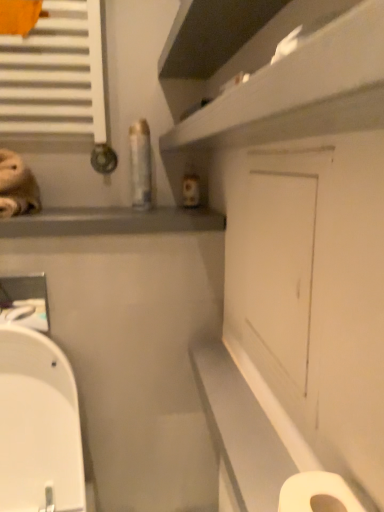
Measure the distance between white glossy toilet at lower left and camera.

The distance of white glossy toilet at lower left from camera is 98.18 centimeters.

This screenshot has height=512, width=384. Find the location of `white matte door at center`. white matte door at center is located at coordinates (274, 258).

Measure the distance between white matte toilet paper at lower right and camera.

white matte toilet paper at lower right and camera are 15.96 inches apart from each other.

Locate an element on the screen. The width and height of the screenshot is (384, 512). white glossy shelf at upper center is located at coordinates (300, 91).

Image resolution: width=384 pixels, height=512 pixels. Describe the element at coordinates (111, 222) in the screenshot. I see `matte gray window sill at upper left` at that location.

You are a GUI agent. You are given a task and a screenshot of the screen. Output one action in this format:
    pyautogui.click(x=<x>, y=<y>)
    Task: Click on the white glossy toilet at lower left
    
    Given the screenshot: What is the action you would take?
    pyautogui.click(x=38, y=425)

From the picture: Is white glossy shelf at upper center inside the boundaries of matte gray window sill at upper left, or outside?

white glossy shelf at upper center is located beyond the bounds of matte gray window sill at upper left.

From the image's perspective, which one is positioned lower, white glossy shelf at upper center or matte gray window sill at upper left?

matte gray window sill at upper left, from the image's perspective.

Is white glossy shelf at upper center oriented towards matte gray window sill at upper left?

No, white glossy shelf at upper center is not facing towards matte gray window sill at upper left.

From a real-world perspective, is white glossy shelf at upper center over matte gray window sill at upper left?

Yes, from a real-world perspective, white glossy shelf at upper center is on top of matte gray window sill at upper left.

From the picture: How different are the orientations of white matte toilet paper at lower right and white glossy shelf at upper center in degrees?

The facing directions of white matte toilet paper at lower right and white glossy shelf at upper center are 0.797 degrees apart.

From the image's perspective, would you say white matte toilet paper at lower right is positioned over white glossy shelf at upper center?

No, from the image's perspective, white matte toilet paper at lower right is not over white glossy shelf at upper center.

Can you confirm if white matte toilet paper at lower right is shorter than white glossy shelf at upper center?

Incorrect, the height of white matte toilet paper at lower right does not fall short of that of white glossy shelf at upper center.

Does white glossy shelf at upper center appear on the right side of white matte toilet paper at lower right?

Correct, you'll find white glossy shelf at upper center to the right of white matte toilet paper at lower right.

From the image's perspective, is white glossy shelf at upper center positioned above or below white matte toilet paper at lower right?

white glossy shelf at upper center is above white matte toilet paper at lower right.

Which of these two, white glossy shelf at upper center or white matte toilet paper at lower right, stands taller?

Standing taller between the two is white matte toilet paper at lower right.

Are white glossy toilet at lower left and white glossy shelf at upper center making contact?

white glossy toilet at lower left and white glossy shelf at upper center are not in contact.

Locate an element on the screen. toilet below the white glossy shelf at upper center (from the image's perspective) is located at coordinates (38, 425).

Is white glossy shelf at upper center completely or partially inside white glossy toilet at lower left?

No, white glossy shelf at upper center is located outside of white glossy toilet at lower left.

In the scene shown: From the image's perspective, who appears lower, white glossy toilet at lower left or white glossy shelf at upper center?

white glossy toilet at lower left is shown below in the image.

From the image's perspective, relative to matte gray window sill at upper left, is white glossy toilet at lower left above or below?

Based on their image positions, white glossy toilet at lower left is located beneath matte gray window sill at upper left.

Would you say white glossy toilet at lower left is outside matte gray window sill at upper left?

Yes.

Does point (13, 358) come behind point (163, 211)?

That is False.

Which object is positioned more to the right, white glossy toilet at lower left or matte gray window sill at upper left?

matte gray window sill at upper left is more to the right.

At what (x,y) coordinates should I click in order to perform the action: click on window sill on the left of white matte door at center. Please return your answer as a coordinate pair (x, y). The width and height of the screenshot is (384, 512). Looking at the image, I should click on (111, 222).

Consider the image. Is matte gray window sill at upper left facing towards white matte door at center?

Yes, matte gray window sill at upper left is oriented towards white matte door at center.

From the image's perspective, which one is positioned lower, matte gray window sill at upper left or white matte door at center?

white matte door at center.

Does white matte door at center touch matte gray window sill at upper left?

No, white matte door at center is not beside matte gray window sill at upper left.

From a real-world perspective, between white matte door at center and matte gray window sill at upper left, who is vertically higher?

In real-world perspective, matte gray window sill at upper left is above.

In the scene shown: Does white matte door at center contain matte gray window sill at upper left?

No.

In the scene shown: Is white matte door at center in front of matte gray window sill at upper left?

Yes, white matte door at center is closer to the viewer.

At what (x,y) coordinates should I click in order to perform the action: click on window sill located underneath the white glossy shelf at upper center (from a real-world perspective). Please return your answer as a coordinate pair (x, y). This screenshot has height=512, width=384. Looking at the image, I should click on (111, 222).

Find the location of `shelf in front of the white matte toilet paper at lower right`. shelf in front of the white matte toilet paper at lower right is located at coordinates (300, 91).

Estimate the real-world distances between objects in this image. Which object is closer to white glossy toilet at lower left, matte gray window sill at upper left or white matte toilet paper at lower right?

Among the two, matte gray window sill at upper left is located nearer to white glossy toilet at lower left.

Looking at the image, which one is located closer to white glossy shelf at upper center, matte gray window sill at upper left or white matte toilet paper at lower right?

matte gray window sill at upper left lies closer to white glossy shelf at upper center than the other object.

Estimate the real-world distances between objects in this image. Which object is further from white glossy toilet at lower left, matte gray window sill at upper left or white matte door at center?

white matte door at center is further to white glossy toilet at lower left.

Based on their spatial positions, is matte gray window sill at upper left or white glossy toilet at lower left closer to white glossy shelf at upper center?

Among the two, matte gray window sill at upper left is located nearer to white glossy shelf at upper center.

When comparing their distances from white glossy shelf at upper center, does white glossy toilet at lower left or white matte toilet paper at lower right seem closer?

white matte toilet paper at lower right lies closer to white glossy shelf at upper center than the other object.

When comparing their distances from white glossy shelf at upper center, does white matte toilet paper at lower right or matte gray window sill at upper left seem further?

Among the two, white matte toilet paper at lower right is located further to white glossy shelf at upper center.

From the image, which object appears to be nearer to white matte door at center, matte gray window sill at upper left or white glossy shelf at upper center?

white glossy shelf at upper center lies closer to white matte door at center than the other object.

Estimate the real-world distances between objects in this image. Which object is closer to white matte door at center, white matte toilet paper at lower right or white glossy toilet at lower left?

white matte toilet paper at lower right lies closer to white matte door at center than the other object.

The image size is (384, 512). Identify the location of toilet between white glossy shelf at upper center and matte gray window sill at upper left along the z-axis. (38, 425).

Identify the location of screen door between matte gray window sill at upper left and white glossy toilet at lower left in the vertical direction. This screenshot has height=512, width=384. (274, 258).

Where is `toilet paper between white glossy shelf at upper center and white glossy toilet at lower left from top to bottom`? Image resolution: width=384 pixels, height=512 pixels. toilet paper between white glossy shelf at upper center and white glossy toilet at lower left from top to bottom is located at coordinates (317, 494).

In order to click on toilet located between white matte toilet paper at lower right and matte gray window sill at upper left in the depth direction in this screenshot , I will do pyautogui.click(x=38, y=425).